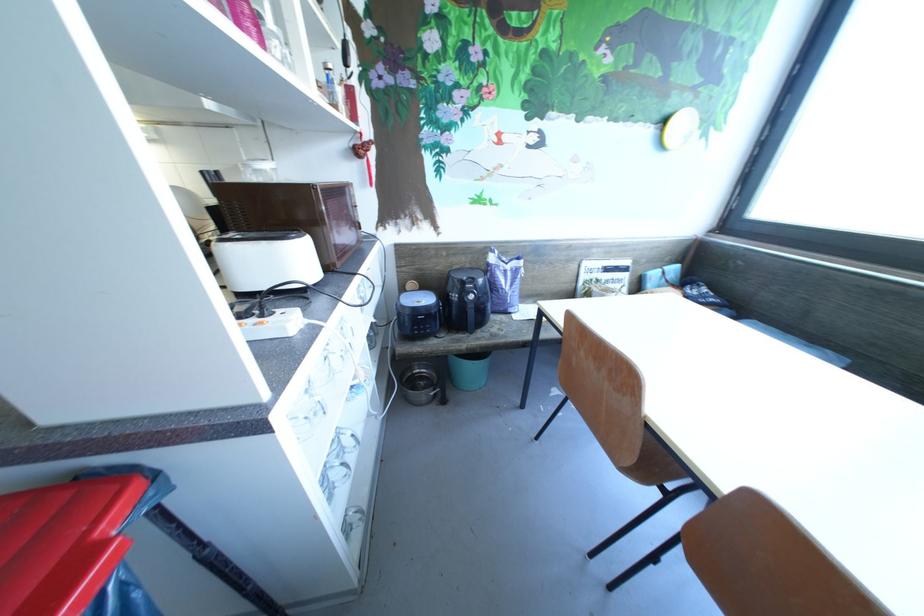
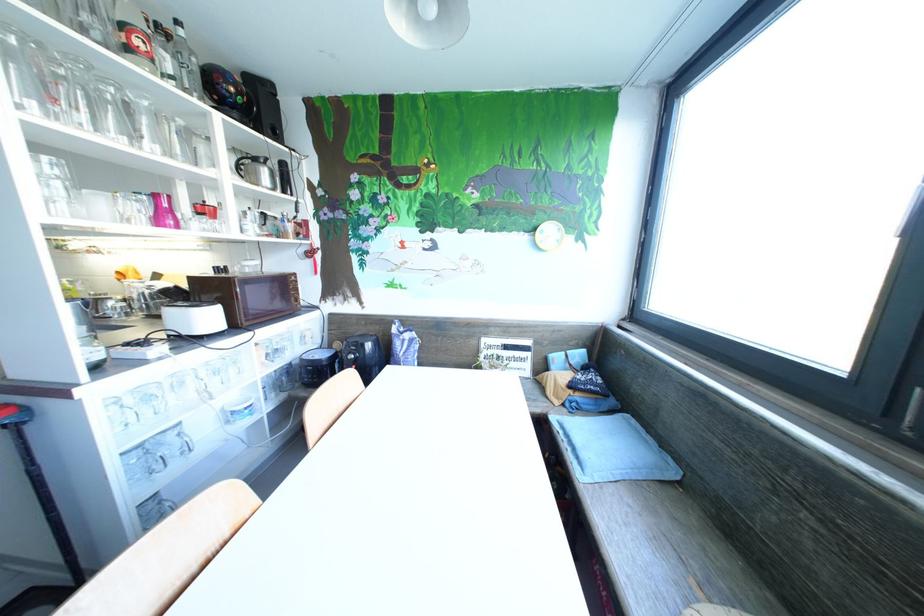
Question: I am providing you with two images of the same scene from different viewpoints. Which of the following objects are not visible in image2?

Choices:
 (A) air fryer handle
 (B) glass cup
 (C) pink plastic cup
 (D) access panel lock

Answer: (A)